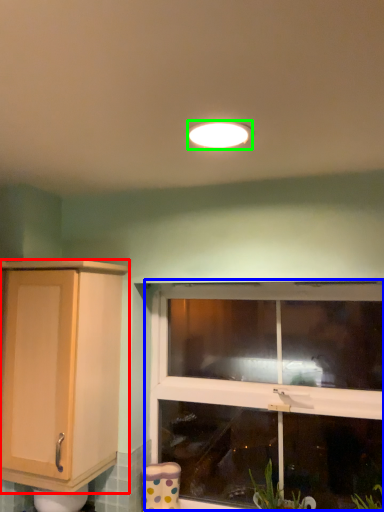
Question: Based on their relative distances, which object is nearer to cabinetry (highlighted by a red box)? Choose from window (highlighted by a blue box) and light fixture (highlighted by a green box).

Choices:
 (A) window
 (B) light fixture

Answer: (A)